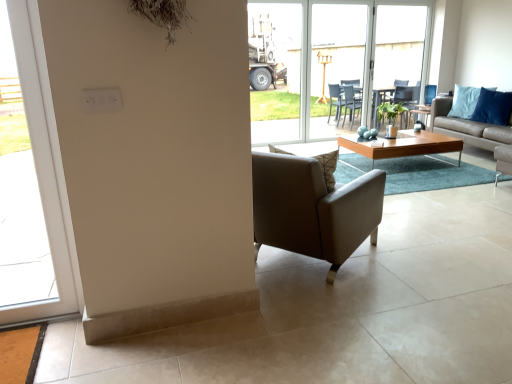
Question: From a real-world perspective, is leather at center physically above transparent plastic screen door at center, arranged as the first screen door when viewed from the left?

Choices:
 (A) no
 (B) yes

Answer: (A)

Question: Is leather at center taller than transparent plastic screen door at center, arranged as the first screen door when viewed from the left?

Choices:
 (A) yes
 (B) no

Answer: (B)

Question: Does leather at center have a smaller size compared to transparent plastic screen door at center, arranged as the first screen door when viewed from the left?

Choices:
 (A) yes
 (B) no

Answer: (B)

Question: Is leather at center in front of transparent plastic screen door at center, arranged as the first screen door when viewed from the left?

Choices:
 (A) no
 (B) yes

Answer: (B)

Question: Is transparent plastic screen door at center, which is the second screen door in right-to-left order, located within leather at center?

Choices:
 (A) yes
 (B) no

Answer: (B)

Question: Is leather at center facing towards transparent plastic screen door at center, which is the second screen door in right-to-left order?

Choices:
 (A) yes
 (B) no

Answer: (A)

Question: Can you confirm if transparent glass screen door at center, marked as the first screen door in a right-to-left arrangement, is thinner than transparent plastic screen door at center, which is the second screen door in right-to-left order?

Choices:
 (A) no
 (B) yes

Answer: (A)

Question: Are transparent glass screen door at center, marked as the first screen door in a right-to-left arrangement, and transparent plastic screen door at center, arranged as the first screen door when viewed from the left, beside each other?

Choices:
 (A) yes
 (B) no

Answer: (B)

Question: Does transparent glass screen door at center, marked as the first screen door in a right-to-left arrangement, lie in front of transparent plastic screen door at center, arranged as the first screen door when viewed from the left?

Choices:
 (A) no
 (B) yes

Answer: (A)

Question: Does transparent glass screen door at center, marked as the first screen door in a right-to-left arrangement, have a larger size compared to transparent plastic screen door at center, arranged as the first screen door when viewed from the left?

Choices:
 (A) no
 (B) yes

Answer: (A)

Question: Would you say transparent glass screen door at center, the 2th screen door from the left, is a long distance from transparent plastic screen door at center, which is the second screen door in right-to-left order?

Choices:
 (A) yes
 (B) no

Answer: (B)

Question: From a real-world perspective, is transparent glass screen door at center, marked as the first screen door in a right-to-left arrangement, under transparent plastic screen door at center, which is the second screen door in right-to-left order?

Choices:
 (A) yes
 (B) no

Answer: (B)

Question: Is leather at center outside of transparent glass screen door at center, the 2th screen door from the left?

Choices:
 (A) no
 (B) yes

Answer: (B)